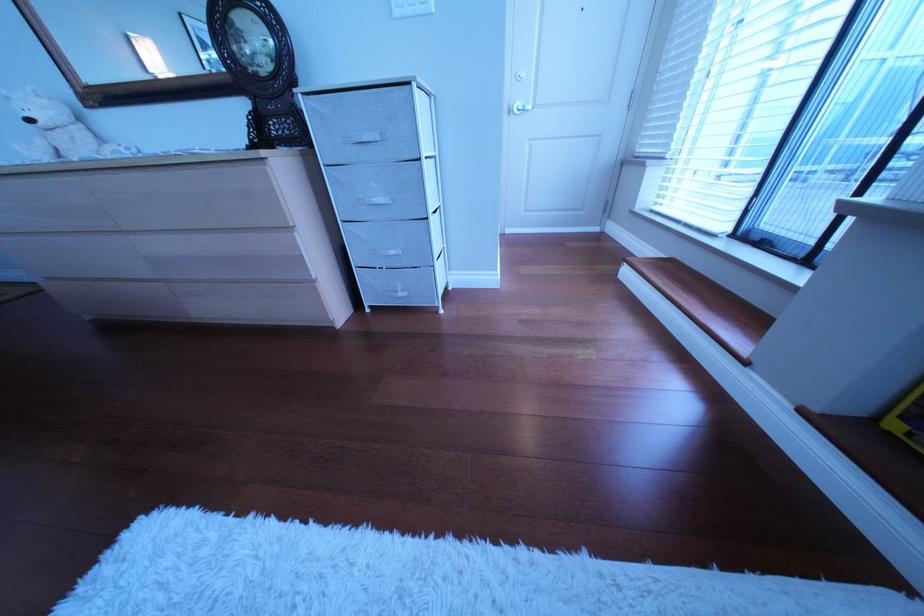
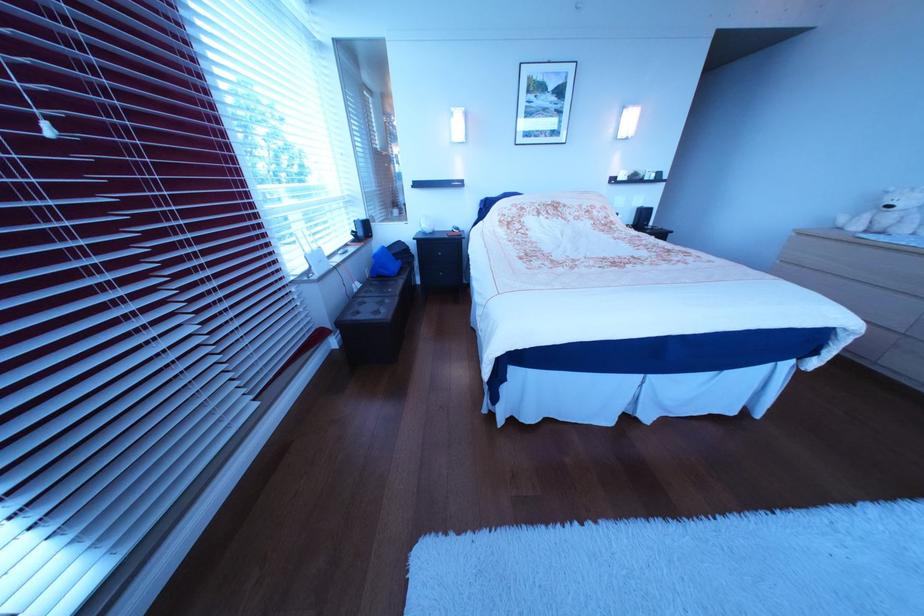
Locate, in the second image, the point that corresponds to the point at 46,122 in the first image.

(906, 209)